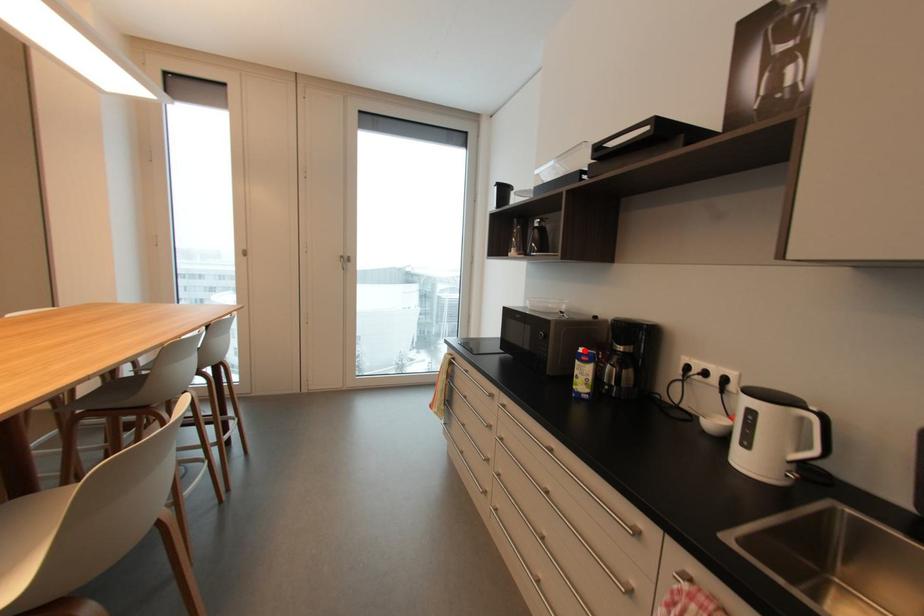
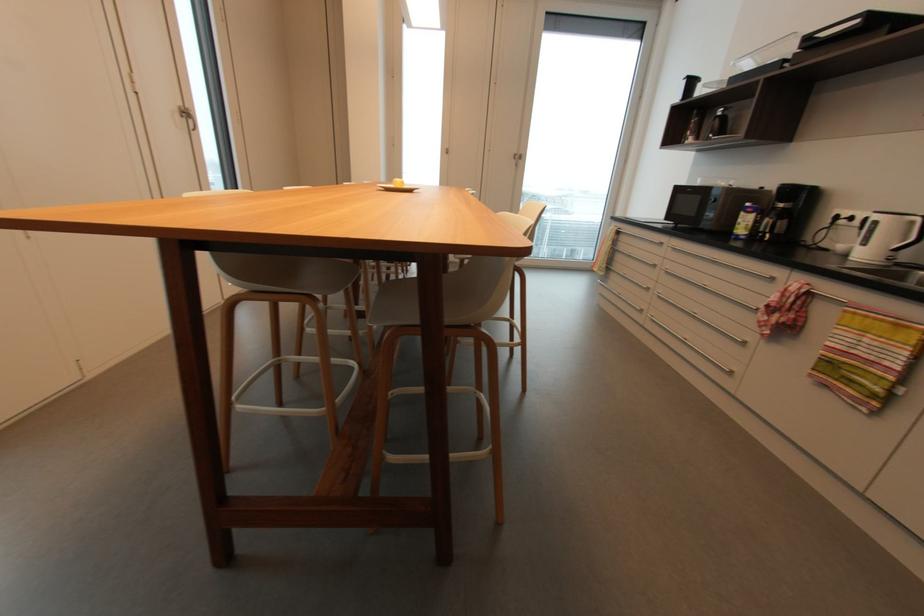
Locate, in the second image, the point that corresponds to the highlighted location in the first image.

(750, 205)